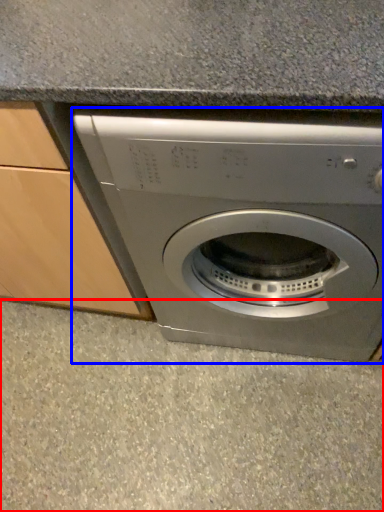
Question: Which of the following is the closest to the observer, concrete (highlighted by a red box) or washing machine (highlighted by a blue box)?

Choices:
 (A) concrete
 (B) washing machine

Answer: (B)